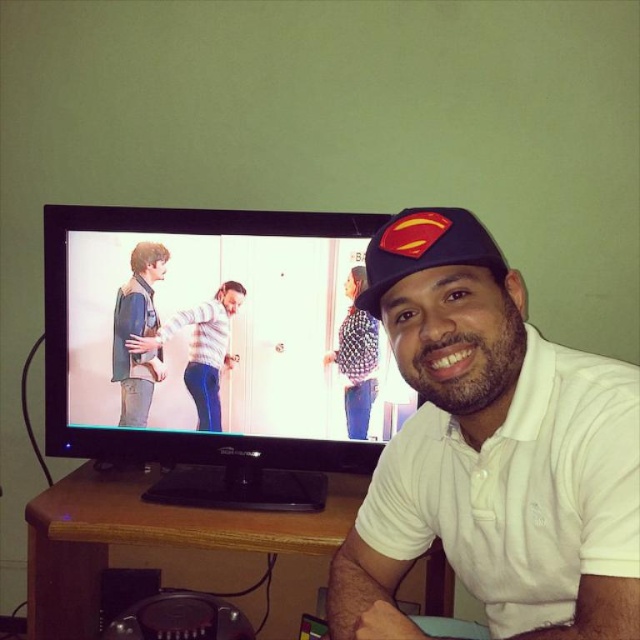
Looking at this image, you are organizing a clothing donation drive and need to know which item is on top. You see a denim jacket at left and a striped sweater at center. Which one is covering the other?

The denim jacket at left is positioned over striped sweater at center, so the denim jacket is covering the striped sweater.

You are a character in the movie shown on the television. You need to exit through the door but can only move past the striped sweater at center. Can you get through the door without going around the denim jacket at left?

The striped sweater at center is behind the denim jacket at left, so you can move past the striped sweater at center without needing to go around the denim jacket at left since it is already behind it.

Looking at this image, you are standing in the room and want to place a small lamp on the wooden table at lower center. Based on the scene description, can you determine the exact location on the table where the lamp should be placed?

The wooden table at lower center is located at point (168, 547), so the lamp should be placed at those coordinates on the table.